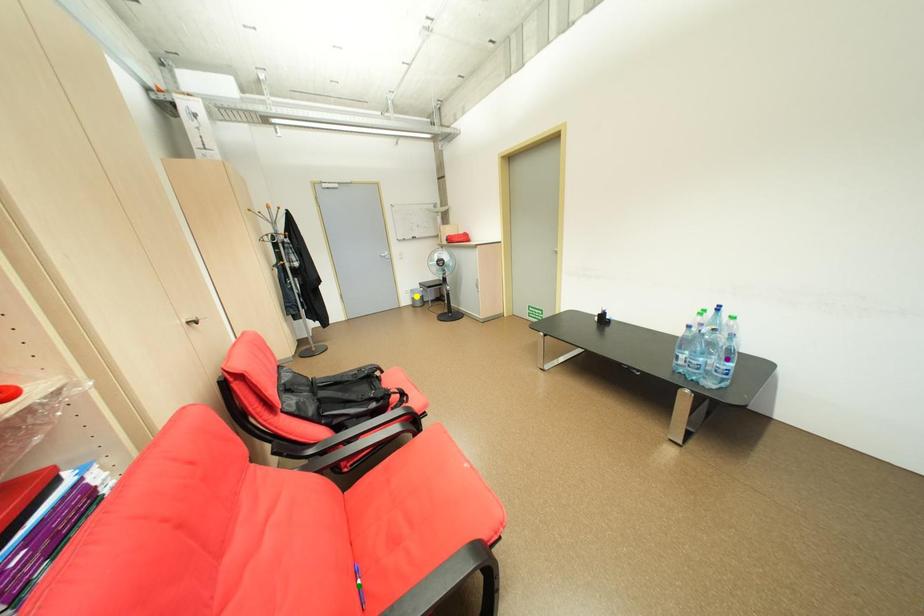
Order these from nearest to farthest:
purple point, yellow point, green point

green point → purple point → yellow point